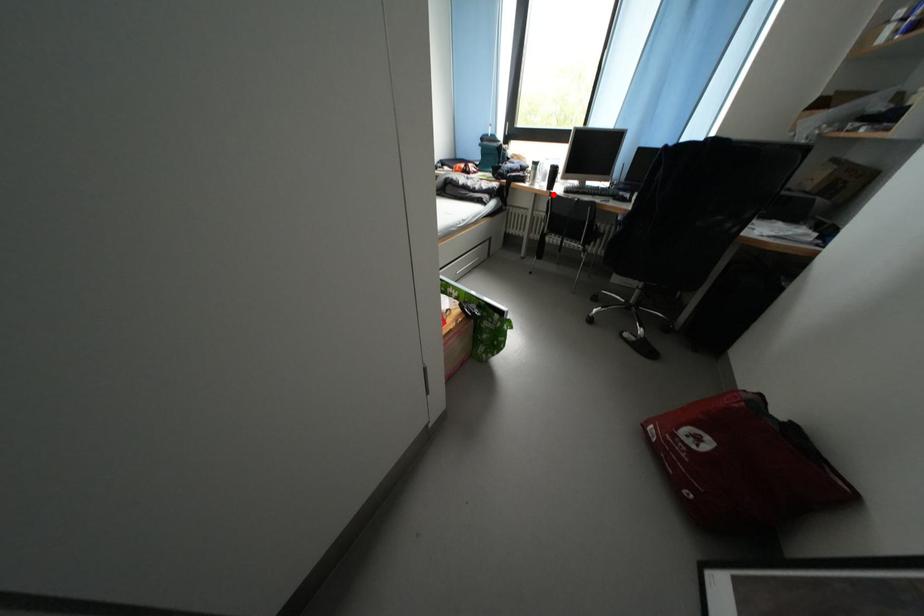
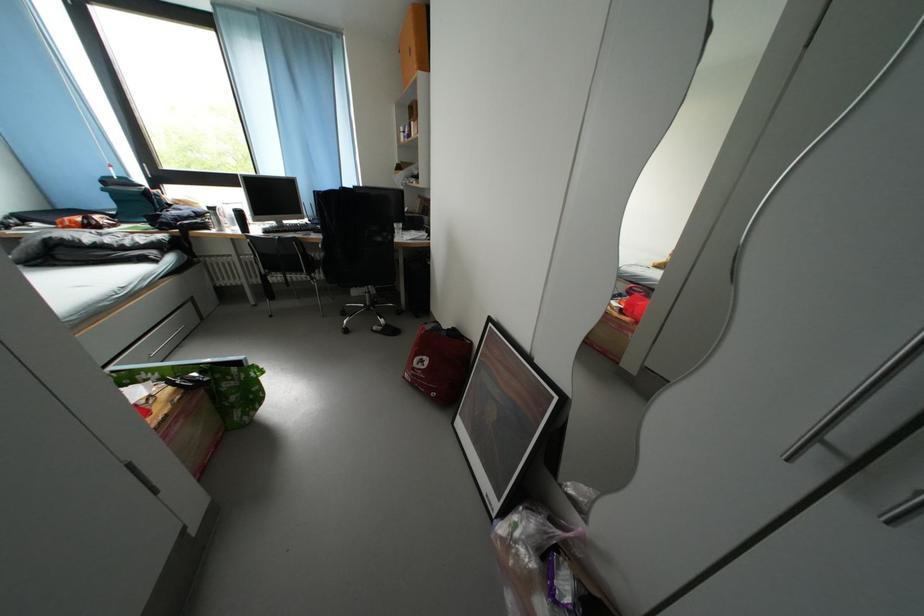
Question: I am providing you with two images of the same scene from different viewpoints. In image1, a red point is highlighted. Considering the same 3D point in image2, which of the following is correct?

Choices:
 (A) It is closer
 (B) It is farther

Answer: (B)